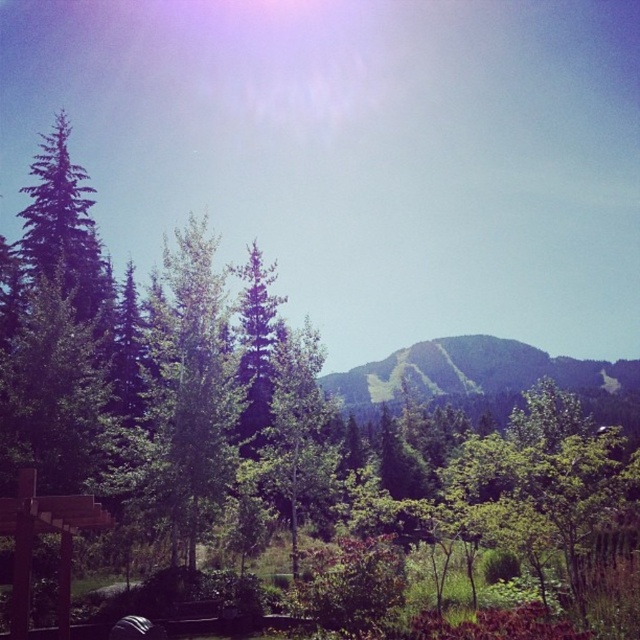
You are hiking and want to take a photo of the green leafy tree at center and the green grassy mountain at center. Since the sun is high, you need to avoid lens flare. Which object should you position in the upper part of the frame to prevent the lens flare from obscuring it?

The green leafy tree at center is located above the green grassy mountain at center. To avoid lens flare, position the green leafy tree at center in the upper part of the frame where the lens flare occurs, so the green grassy mountain at center remains clear below.

You are planning to take a photo of the green leafy tree at center and the green grassy mountain at center. Which one will appear smaller in the photo?

The green leafy tree at center will appear smaller in the photo because it occupies less space than the green grassy mountain at center.

You are standing in the natural landscape described. You see a point marked at coordinates (186, 396). What object is located at that point?

The point at coordinates (186, 396) corresponds to the green leafy tree at center.